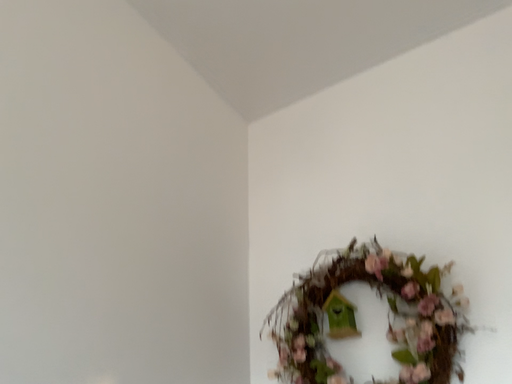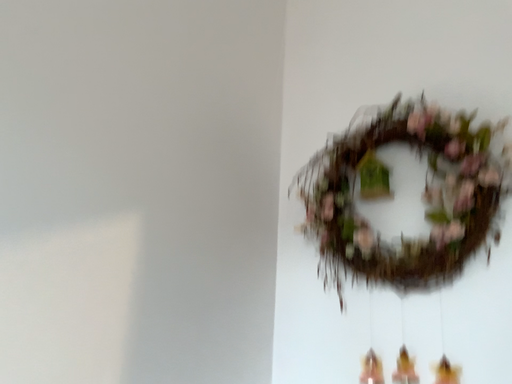
Question: How did the camera likely rotate when shooting the video?

Choices:
 (A) rotated downward
 (B) rotated upward

Answer: (A)